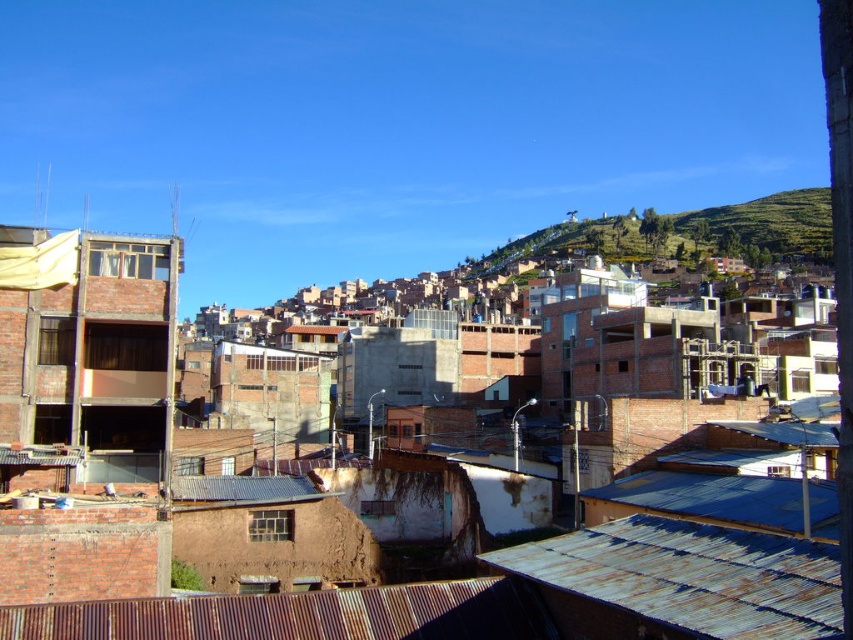
From the picture: Does rusty corrugated metal roof at lower center appear under blue corrugated metal roof at lower right?

Correct, rusty corrugated metal roof at lower center is located below blue corrugated metal roof at lower right.

Can you confirm if rusty corrugated metal roof at lower center is wider than blue corrugated metal roof at lower right?

Yes.

Find the location of a particular element. rusty corrugated metal roof at lower center is located at coordinates (287, 614).

Can you confirm if rusty corrugated metal roof at lower right is shorter than blue corrugated metal roof at lower right?

No.

Does rusty corrugated metal roof at lower right have a lesser width compared to blue corrugated metal roof at lower right?

No.

Between point (749, 541) and point (656, 509), which one is positioned behind?

The point (656, 509) is behind.

Identify the location of rusty corrugated metal roof at lower right. (680, 580).

Does rusty corrugated metal roof at lower right lie behind green grassy hillside at upper center?

No.

Does rusty corrugated metal roof at lower right lie in front of green grassy hillside at upper center?

Yes, rusty corrugated metal roof at lower right is closer to the viewer.

Is point (488, 560) in front of point (537, 243)?

That is True.

The height and width of the screenshot is (640, 853). I want to click on rusty corrugated metal roof at lower right, so click(680, 580).